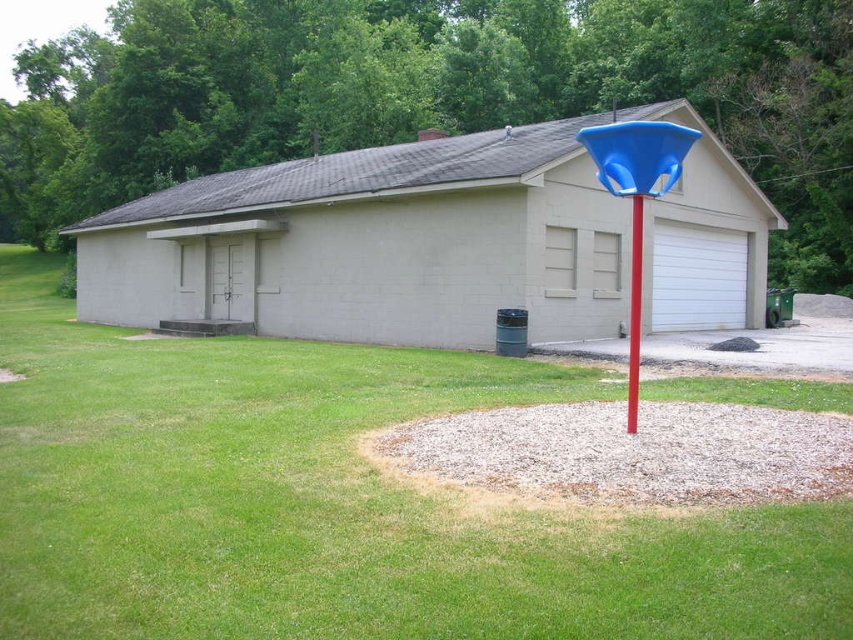
Measure the distance between point (141, 496) and camera.

They are 5.44 meters apart.

Does green grass at center appear on the right side of matte concrete garage at center?

Incorrect, green grass at center is not on the right side of matte concrete garage at center.

Measure the distance between point (728, 390) and camera.

Point (728, 390) is 10.40 meters away from camera.

At what (x,y) coordinates should I click in order to perform the action: click on green grass at center. Please return your answer as a coordinate pair (x, y). The width and height of the screenshot is (853, 640). Looking at the image, I should click on (335, 502).

Which is in front, point (134, 493) or point (640, 276)?

Point (134, 493)

Can you confirm if green grass at center is wider than blue plastic pole at center?

Yes, green grass at center is wider than blue plastic pole at center.

Locate an element on the screen. The image size is (853, 640). green grass at center is located at coordinates (335, 502).

Which is more to the right, matte concrete garage at center or blue plastic pole at center?

From the viewer's perspective, blue plastic pole at center appears more on the right side.

Identify the location of matte concrete garage at center. The width and height of the screenshot is (853, 640). (374, 244).